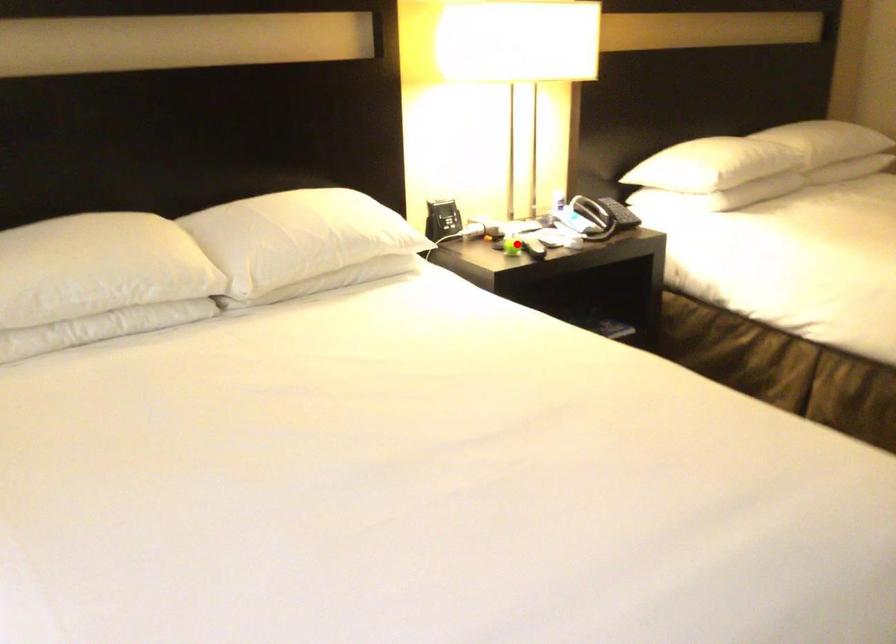
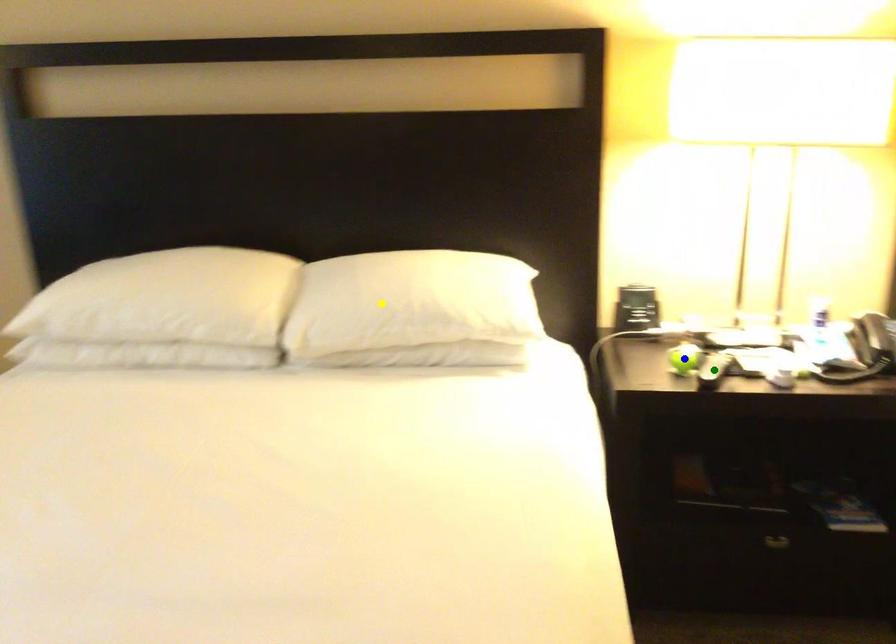
Question: I am providing you with two images of the same scene from different viewpoints. A red point is marked on the first image. You are given multiple points on the second image. Which mark in image 2 goes with the point in image 1?

Choices:
 (A) yellow point
 (B) green point
 (C) blue point

Answer: (C)